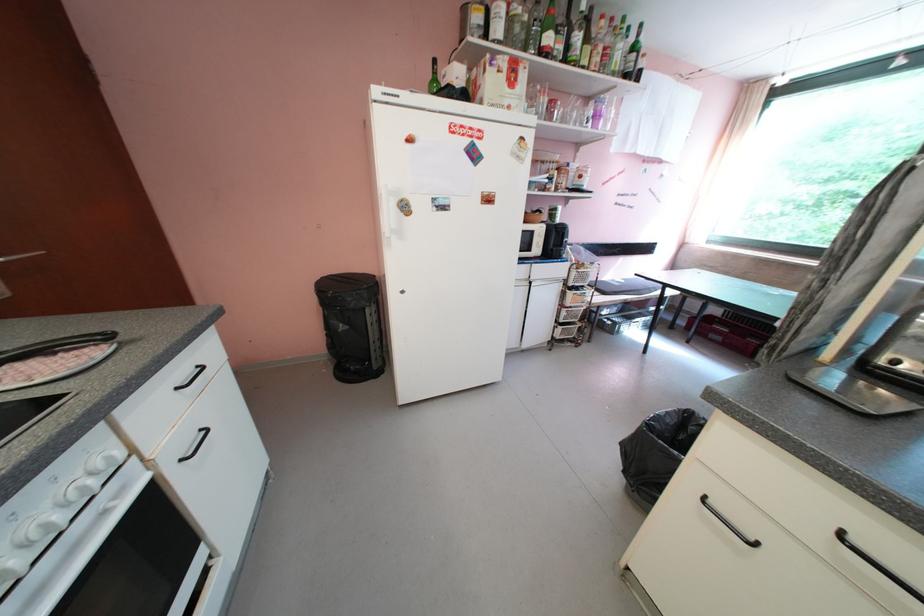
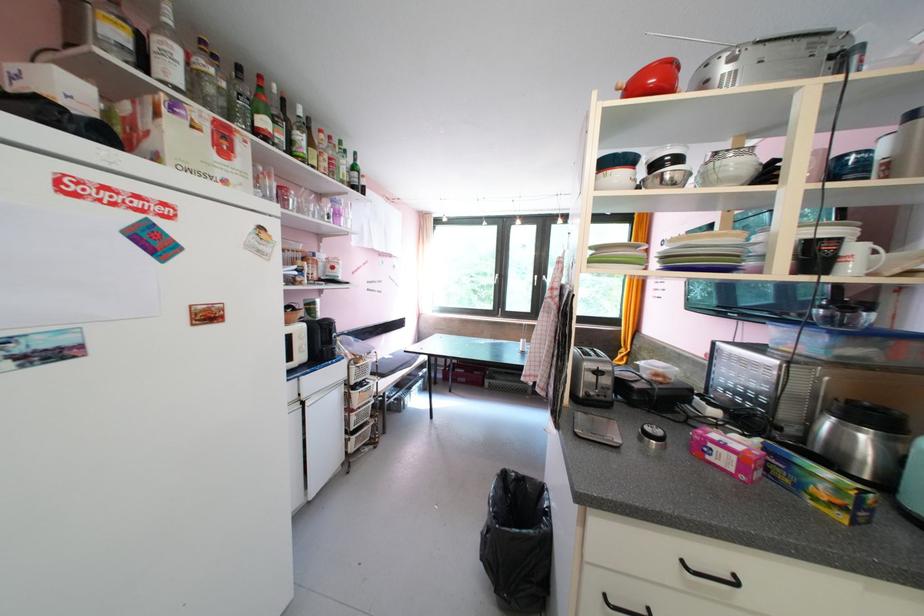
The point at (556, 41) is marked in the first image. Where is the corresponding point in the second image?

(273, 124)